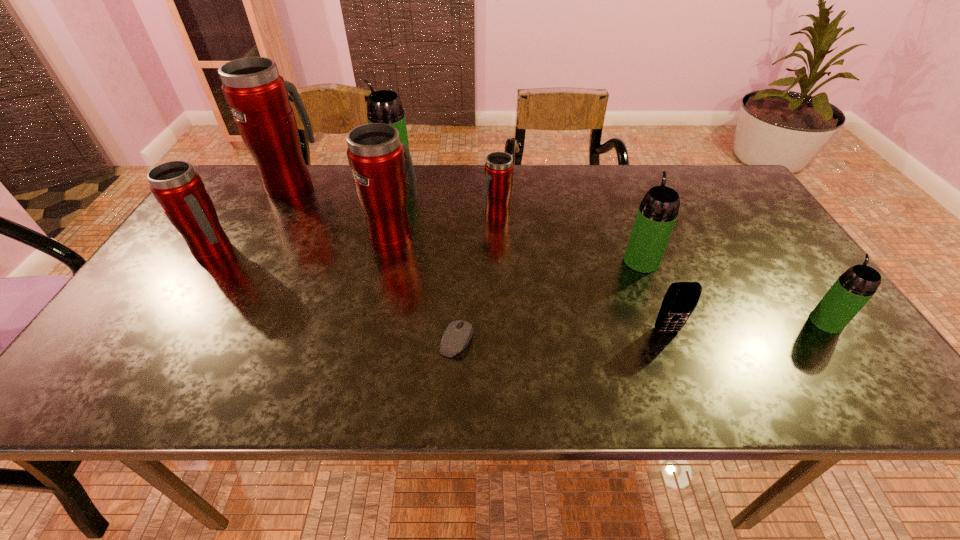
I want to click on the third thermos bottle from right to left, so click(x=497, y=186).

Find the location of `the rightmost red thermos bottle`. the rightmost red thermos bottle is located at coordinates (497, 186).

This screenshot has height=540, width=960. What are the coordinates of `the second shortest object` in the screenshot? It's located at (681, 298).

Where is `computer equipment`? Image resolution: width=960 pixels, height=540 pixels. computer equipment is located at coordinates (458, 333).

Locate an element on the screen. black computer equipment is located at coordinates (458, 333).

This screenshot has width=960, height=540. I want to click on free spot located 0.120m from the spout of the biggest green thermos bottle, so click(x=340, y=175).

The width and height of the screenshot is (960, 540). What are the coordinates of `free location located from the spout of the biggest green thermos bottle` in the screenshot? It's located at (362, 175).

This screenshot has height=540, width=960. Find the location of `vacant space situated 0.240m from the spout of the biggest green thermos bottle`. vacant space situated 0.240m from the spout of the biggest green thermos bottle is located at coordinates point(302,175).

Locate an element on the screen. This screenshot has width=960, height=540. vacant space located 0.080m on the side with the handle of the second biggest red thermos bottle is located at coordinates (400, 202).

This screenshot has height=540, width=960. I want to click on vacant space located on the side with the handle of the second biggest red thermos bottle, so click(403, 191).